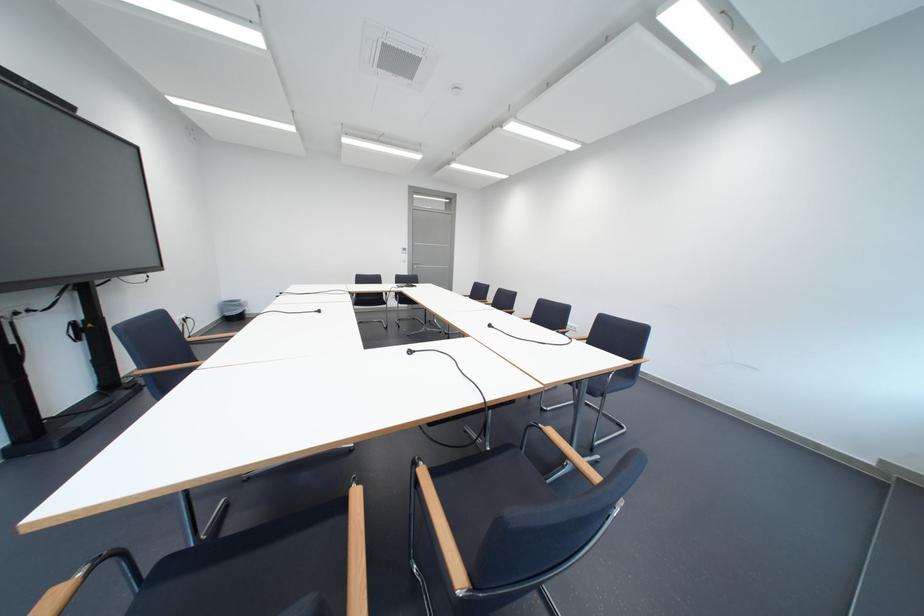
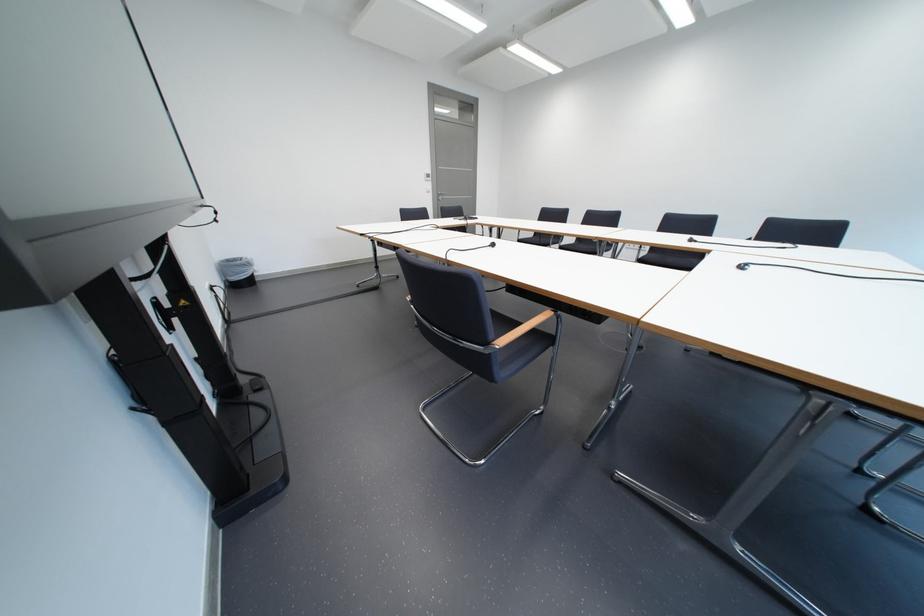
Question: Which direction would the cameraman need to move to produce the second image? Reply with the corresponding letter.

Choices:
 (A) Left
 (B) Right
 (C) Forward
 (D) Backward

Answer: (A)